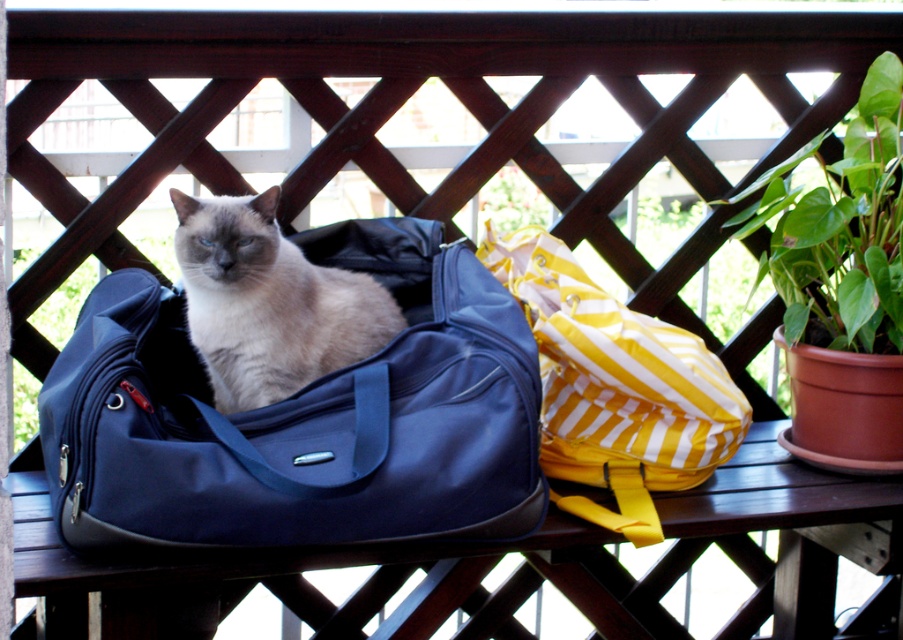
Can you confirm if green glossy leaf at upper right is wider than green leafy plant at upper left?

Yes, green glossy leaf at upper right is wider than green leafy plant at upper left.

Where is `green glossy leaf at upper right`? This screenshot has height=640, width=903. green glossy leaf at upper right is located at coordinates (840, 228).

Is the position of yellow striped backpack at right more distant than that of green glossy leaf at upper right?

That is False.

Which of these two, yellow striped backpack at right or green glossy leaf at upper right, stands shorter?

yellow striped backpack at right

Locate an element on the screen. Image resolution: width=903 pixels, height=640 pixels. yellow striped backpack at right is located at coordinates (615, 387).

Can you confirm if matte blue duffel bag at center is thinner than yellow striped backpack at right?

No.

Who is more distant from viewer, [408,509] or [629,436]?

The point [629,436] is more distant.

Who is more forward, (489, 396) or (678, 368)?

Point (489, 396) is in front.

The image size is (903, 640). What are the coordinates of `matte blue duffel bag at center` in the screenshot? It's located at (301, 417).